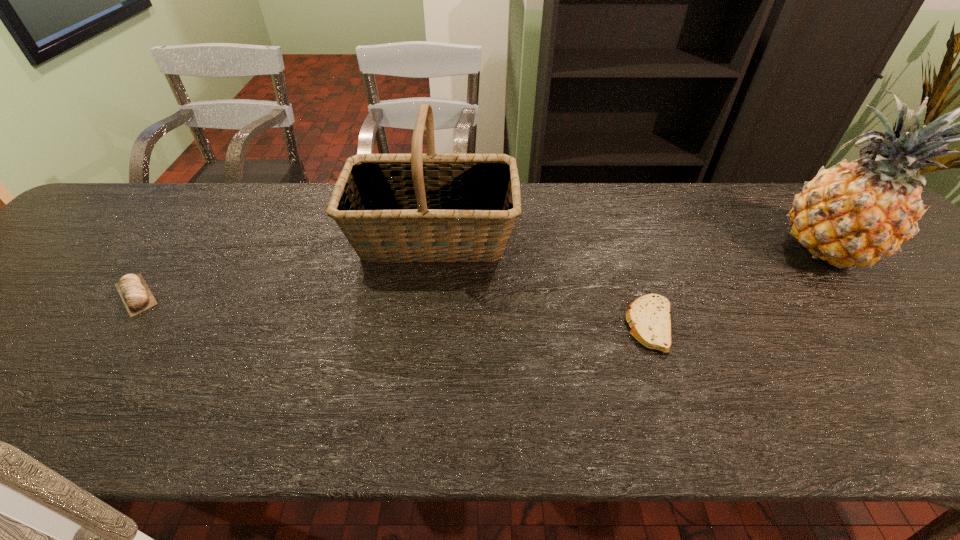
The height and width of the screenshot is (540, 960). I want to click on vacant space located 0.190m on the left of the taller pita bread, so click(27, 295).

This screenshot has height=540, width=960. In order to click on blank space located on the front of the shorter pita bread in this screenshot , I will do `click(684, 423)`.

Locate an element on the screen. The height and width of the screenshot is (540, 960). pineapple at the far edge is located at coordinates (854, 213).

Where is `basket at the far edge`? This screenshot has width=960, height=540. basket at the far edge is located at coordinates (416, 207).

This screenshot has height=540, width=960. Find the location of `object that is at the right edge`. object that is at the right edge is located at coordinates (854, 213).

Find the location of a particular element. The width and height of the screenshot is (960, 540). object that is at the far right corner is located at coordinates (854, 213).

In the image, there is a desktop. Identify the location of free space at the far edge. Image resolution: width=960 pixels, height=540 pixels. (730, 184).

In the image, there is a desktop. In order to click on vacant space at the near edge in this screenshot , I will do `click(138, 440)`.

I want to click on vacant space at the right edge, so click(x=922, y=313).

The height and width of the screenshot is (540, 960). What are the coordinates of `free space between the rightmost object and the second object from left to right` in the screenshot? It's located at (631, 243).